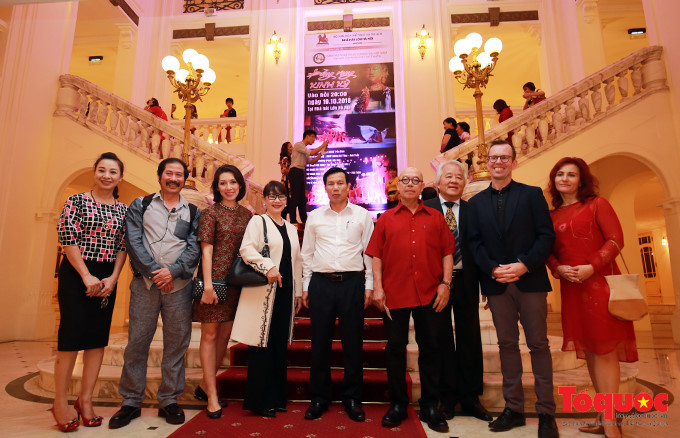
Locate an element on the screen. This screenshot has height=438, width=680. marble floor is located at coordinates (24, 418).